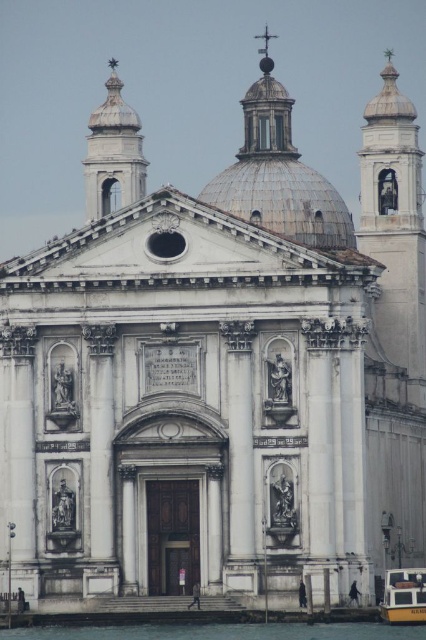
Question: Is transparent water at lower center smaller than yellowish metallic boat at lower right?

Choices:
 (A) yes
 (B) no

Answer: (B)

Question: Does transparent water at lower center appear on the right side of yellowish metallic boat at lower right?

Choices:
 (A) yes
 (B) no

Answer: (B)

Question: Can you confirm if transparent water at lower center is wider than yellowish metallic boat at lower right?

Choices:
 (A) yes
 (B) no

Answer: (A)